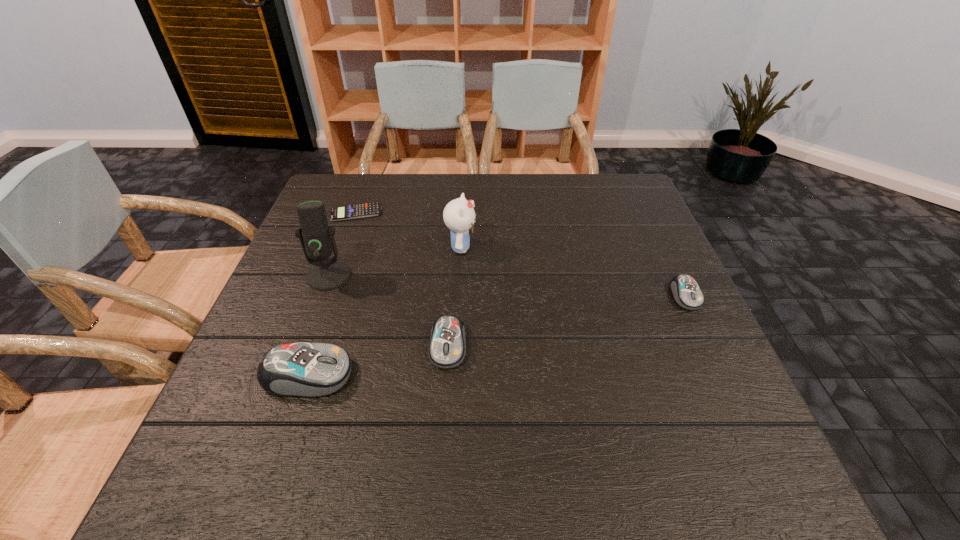
Locate which object is the fourth closest to the fifth nearest object. Please provide its 2D coordinates. Your answer should be formatted as a tuple, i.e. [(x, y)], where the tuple contains the x and y coordinates of a point satisfying the conditions above.

[(299, 369)]

Where is `object that is the fifth closest to the third shortest object`? Image resolution: width=960 pixels, height=540 pixels. object that is the fifth closest to the third shortest object is located at coordinates (686, 292).

Identify which computer mouse is the nearest to the tallest object. Please provide its 2D coordinates. Your answer should be formatted as a tuple, i.e. [(x, y)], where the tuple contains the x and y coordinates of a point satisfying the conditions above.

[(299, 369)]

You are a GUI agent. You are given a task and a screenshot of the screen. Output one action in this format:
    pyautogui.click(x=<x>, y=<y>)
    Task: Click on the closest computer mouse to the tallest object
    The image size is (960, 540).
    Given the screenshot: What is the action you would take?
    pyautogui.click(x=299, y=369)

This screenshot has height=540, width=960. Find the location of `free spot that satisfies the following two spatial constraints: 1. on the wheel side of the second computer mouse from left to right; 2. on the wheel side of the fourth shortest object`. free spot that satisfies the following two spatial constraints: 1. on the wheel side of the second computer mouse from left to right; 2. on the wheel side of the fourth shortest object is located at coordinates (446, 375).